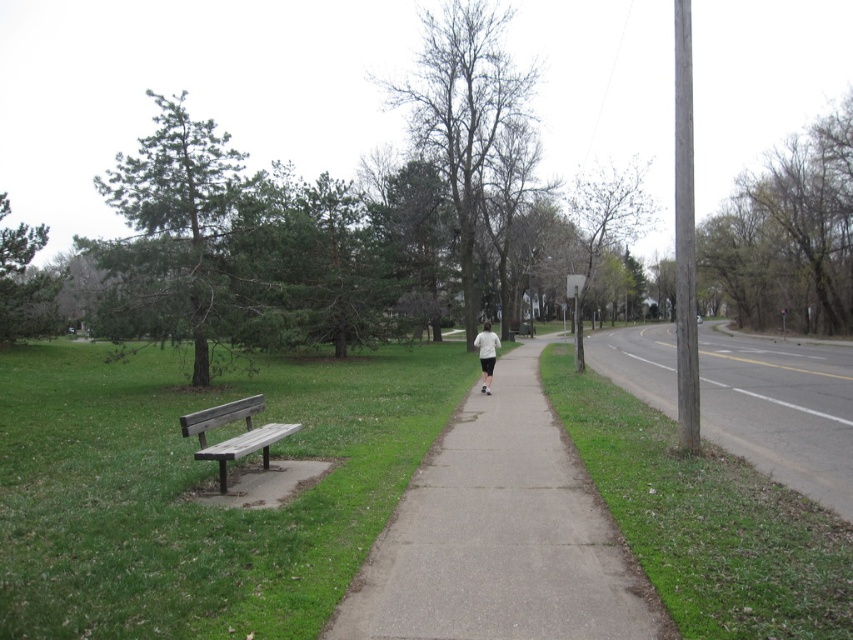
Is gray asphalt road at right taller than wooden bench at left?

Yes.

Can you confirm if gray asphalt road at right is positioned to the left of wooden bench at left?

In fact, gray asphalt road at right is to the right of wooden bench at left.

Is point (775, 433) positioned before point (248, 401)?

That is False.

You are a GUI agent. You are given a task and a screenshot of the screen. Output one action in this format:
    pyautogui.click(x=<x>, y=<y>)
    Task: Click on the gray asphalt road at right
    
    Given the screenshot: What is the action you would take?
    pyautogui.click(x=781, y=410)

The width and height of the screenshot is (853, 640). What are the coordinates of `gray concrete sidewalk at center` in the screenshot? It's located at (500, 534).

How far apart are gray concrete sidewalk at center and gray asphalt road at right?

gray concrete sidewalk at center is 15.93 meters from gray asphalt road at right.

Find the location of `gray concrete sidewalk at center`. gray concrete sidewalk at center is located at coordinates (500, 534).

You are a GUI agent. You are given a task and a screenshot of the screen. Output one action in this format:
    pyautogui.click(x=<x>, y=<y>)
    Task: Click on the gray concrete sidewalk at center
    The height and width of the screenshot is (640, 853).
    Given the screenshot: What is the action you would take?
    pyautogui.click(x=500, y=534)

Is gray asphalt road at right below white matte shirt at center?

Yes.

Is gray asphalt road at right to the left of white matte shirt at center from the viewer's perspective?

Incorrect, gray asphalt road at right is not on the left side of white matte shirt at center.

Which is in front, point (646, 336) or point (485, 369)?

Point (485, 369) is more forward.

Find the location of a particular element. gray asphalt road at right is located at coordinates (781, 410).